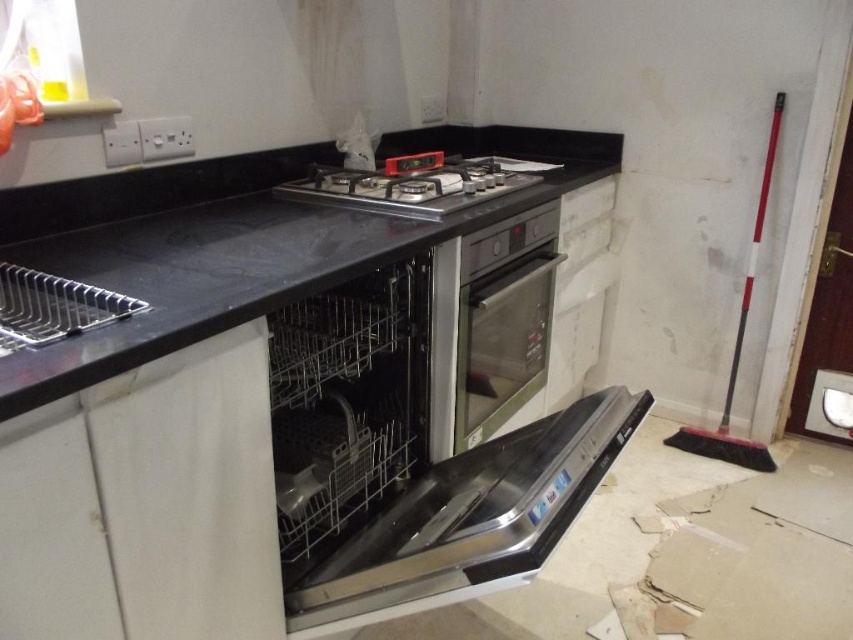
You are a contractor checking the kitchen layout. You need to ensure that the black matte counter top at center and the black matte gas stove at center are positioned correctly. Based on their heights, which one is higher?

The black matte counter top at center is taller than the black matte gas stove at center, so the counter top is higher.

You are a kitchen designer who needs to install a new microwave that requires at least 14 inches of space between it and the oven. Given the current setup with the satin silver oven at center and the black matte gas stove at center, is there enough space between them to place the microwave?

The distance between the satin silver oven at center and the black matte gas stove at center is 12.79 inches, which is less than the required 14 inches. Therefore, there isn not enough space to place the microwave between them.